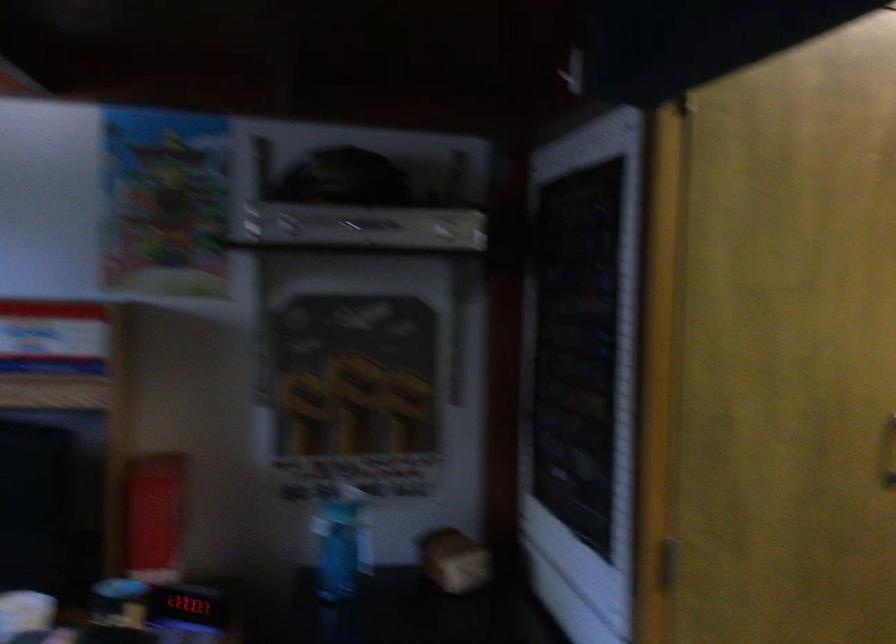
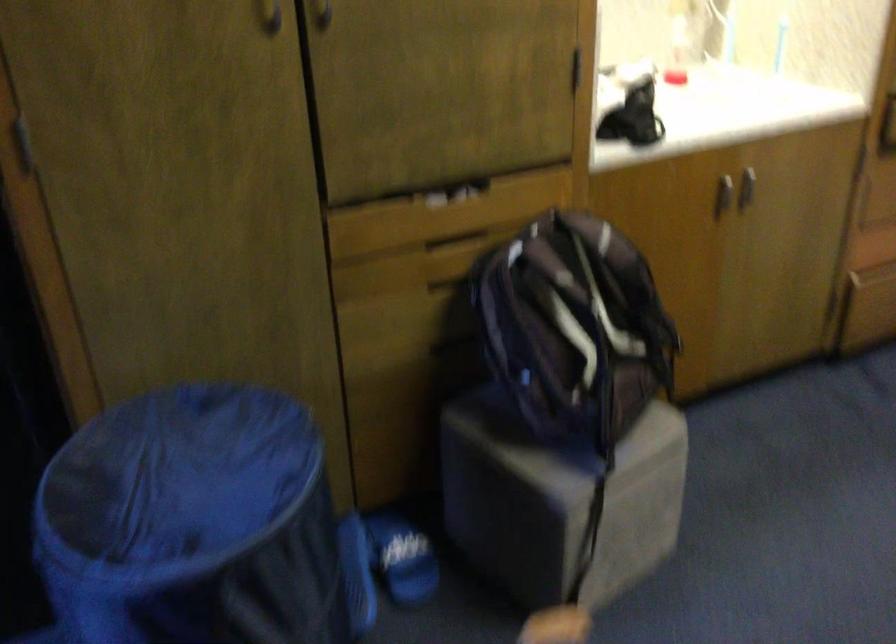
Question: Which direction would the cameraman need to move to produce the second image? Reply with the corresponding letter.

Choices:
 (A) Left
 (B) Right
 (C) Forward
 (D) Backward

Answer: (B)